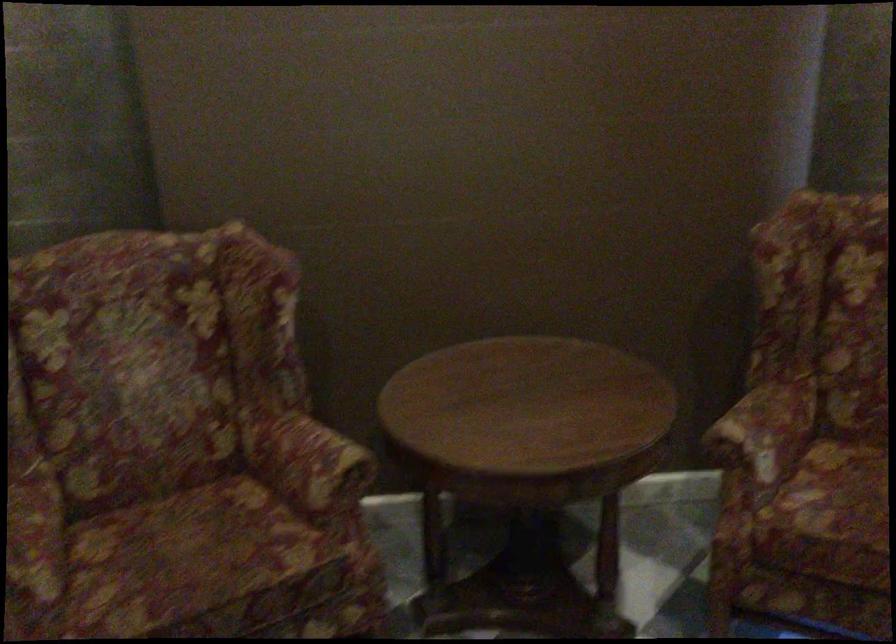
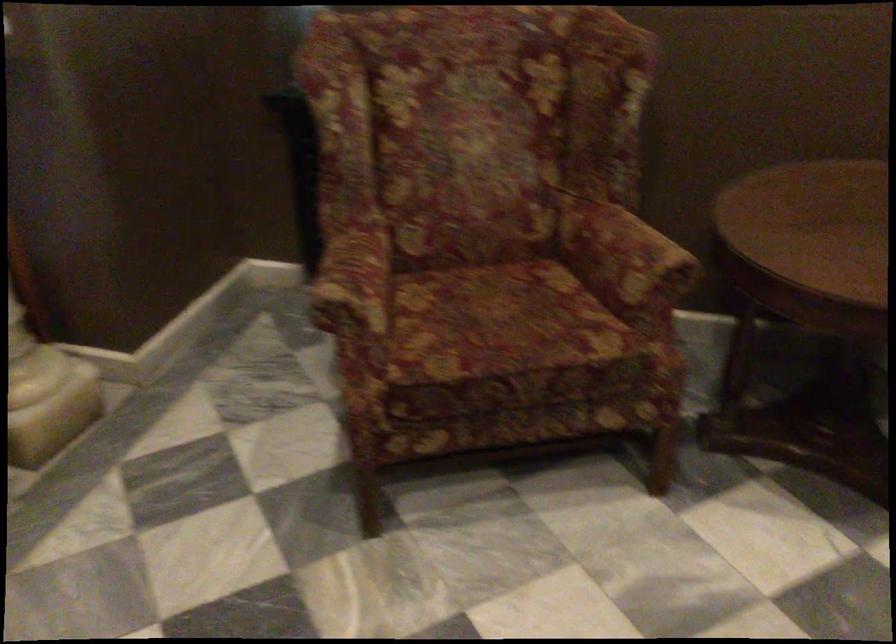
The point at (306, 465) is marked in the first image. Where is the corresponding point in the second image?

(624, 258)